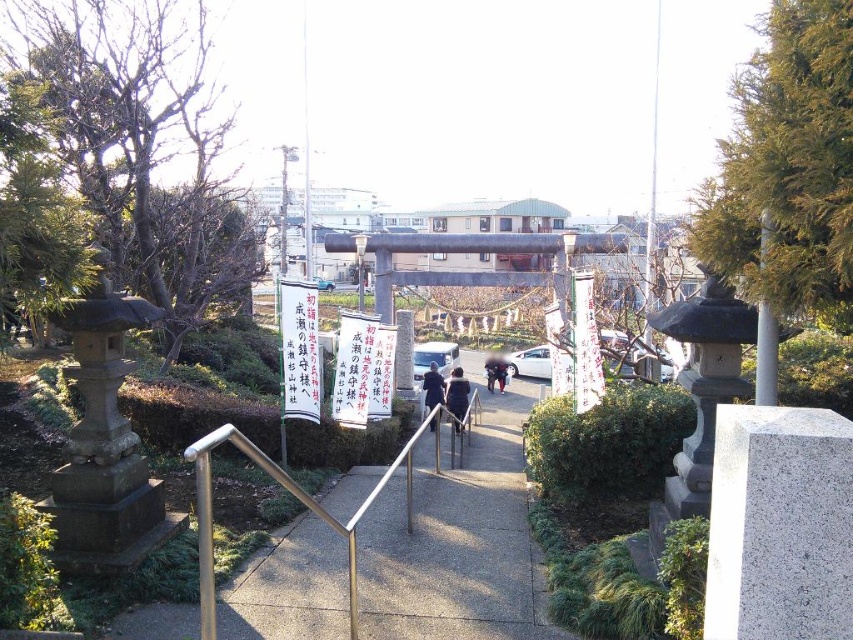
Which is below, metallic silver car at center or dark blue coat at center?

Positioned lower is dark blue coat at center.

Is point (422, 346) in front of point (427, 397)?

No, it is not.

This screenshot has height=640, width=853. In order to click on metallic silver car at center in this screenshot , I will do `click(434, 356)`.

The width and height of the screenshot is (853, 640). I want to click on metallic silver car at center, so click(x=434, y=356).

Who is more distant from viewer, (457, 364) or (456, 385)?

The point (457, 364) is more distant.

Is point (445, 352) farther from camera compared to point (447, 396)?

Yes, point (445, 352) is farther from viewer.

This screenshot has width=853, height=640. What are the coordinates of `metallic silver car at center` in the screenshot? It's located at (434, 356).

Is dark blue jacket at center wider than dark blue coat at center?

Correct, the width of dark blue jacket at center exceeds that of dark blue coat at center.

Can you confirm if dark blue jacket at center is smaller than dark blue coat at center?

Indeed, dark blue jacket at center has a smaller size compared to dark blue coat at center.

Who is more forward, (456, 384) or (436, 368)?

Positioned in front is point (456, 384).

I want to click on dark blue jacket at center, so click(x=457, y=396).